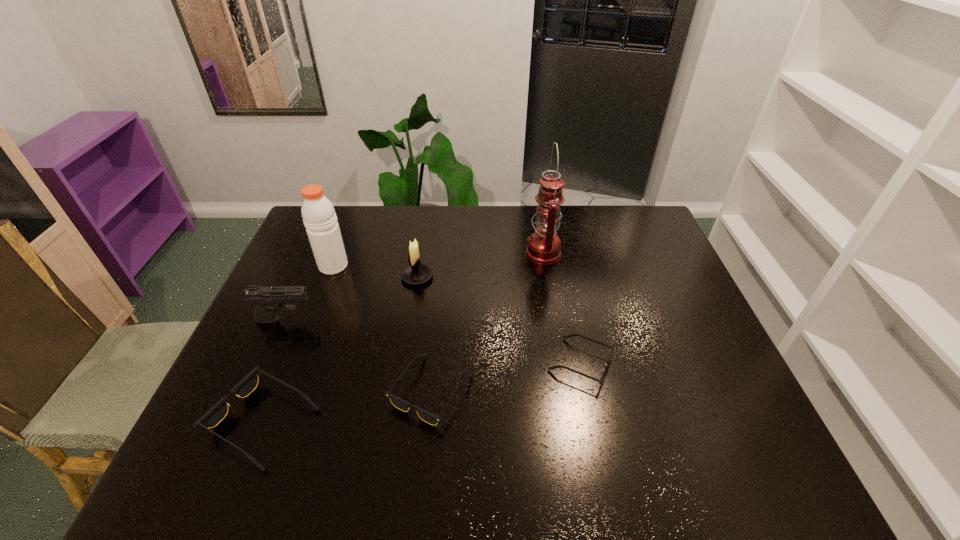
In the image, there is a desktop. Identify the location of free space at the far edge. (600, 213).

This screenshot has width=960, height=540. In the image, there is a desktop. In order to click on vacant space at the near edge in this screenshot , I will do `click(515, 408)`.

In the image, there is a desktop. Find the location of `vacant area at the left edge`. vacant area at the left edge is located at coordinates (283, 350).

Identify the location of vacant space at the right edge of the desktop. Image resolution: width=960 pixels, height=540 pixels. (680, 346).

Locate an element on the screen. free space at the far left corner is located at coordinates (346, 219).

Where is `blank space at the near left corner`? This screenshot has width=960, height=540. blank space at the near left corner is located at coordinates (238, 400).

Locate an element on the screen. Image resolution: width=960 pixels, height=540 pixels. free space between the sixth tallest object and the shortest object is located at coordinates (506, 377).

Find the location of a particular element. The width and height of the screenshot is (960, 540). vacant area that lies between the fourth tallest object and the third tallest object is located at coordinates (351, 298).

This screenshot has width=960, height=540. Find the location of `empty space between the leftmost sunglasses and the oil lamp`. empty space between the leftmost sunglasses and the oil lamp is located at coordinates (403, 338).

Identify the location of blank region between the second sunglasses from right to left and the leftmost sunglasses. The width and height of the screenshot is (960, 540). (348, 406).